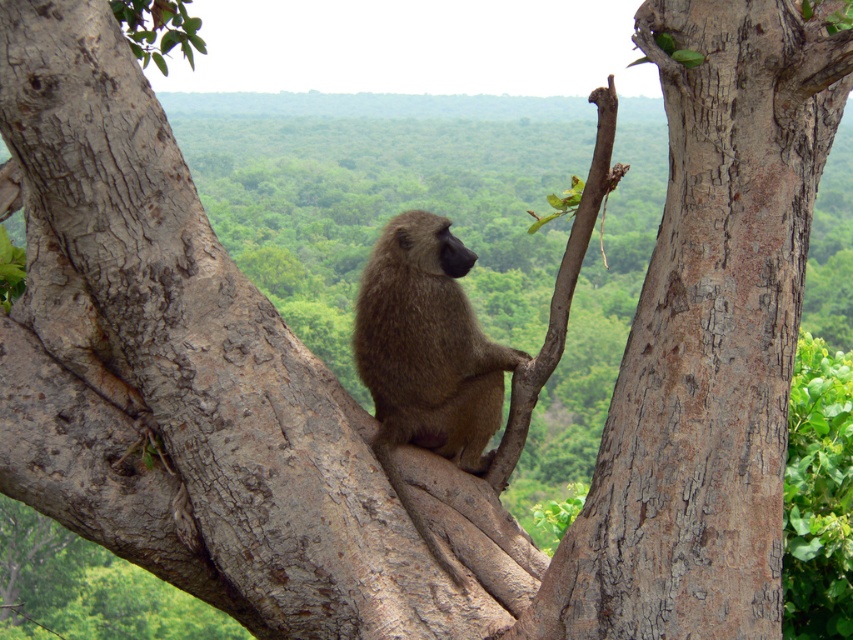
Question: Is gray rough bark tree trunk at center positioned at the back of brown rough bark at upper center?

Choices:
 (A) no
 (B) yes

Answer: (A)

Question: Can you confirm if gray rough bark tree trunk at center is bigger than brown rough bark at upper center?

Choices:
 (A) no
 (B) yes

Answer: (B)

Question: Among these points, which one is nearest to the camera?

Choices:
 (A) (641, 300)
 (B) (473, 460)

Answer: (A)

Question: Which point is farther to the camera?

Choices:
 (A) (561, 291)
 (B) (477, 410)
 (C) (683, 67)

Answer: (B)

Question: Is the position of fuzzy brown monkey at center more distant than that of brown rough bark at upper center?

Choices:
 (A) yes
 (B) no

Answer: (A)

Question: Which point is farther to the camera?

Choices:
 (A) fuzzy brown monkey at center
 (B) gray rough bark tree trunk at center

Answer: (A)